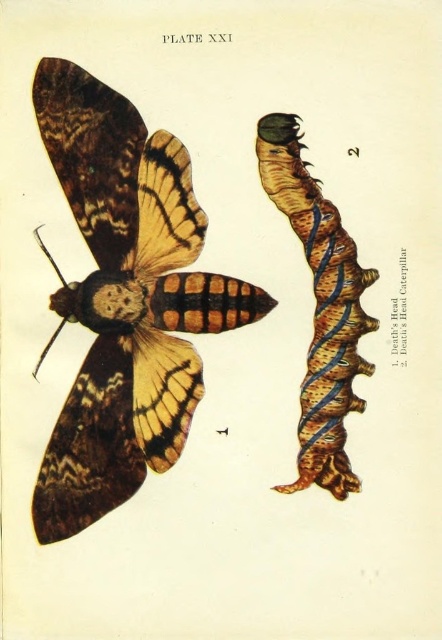
Question: Can you confirm if brown textured moth at left is thinner than brown textured caterpillar at right?

Choices:
 (A) no
 (B) yes

Answer: (A)

Question: Among these objects, which one is nearest to the camera?

Choices:
 (A) brown textured moth at left
 (B) brown textured caterpillar at right

Answer: (A)

Question: Among these objects, which one is farthest from the camera?

Choices:
 (A) brown textured caterpillar at right
 (B) brown textured moth at left

Answer: (A)

Question: Does brown textured moth at left come in front of brown textured caterpillar at right?

Choices:
 (A) yes
 (B) no

Answer: (A)

Question: Considering the relative positions of brown textured moth at left and brown textured caterpillar at right in the image provided, where is brown textured moth at left located with respect to brown textured caterpillar at right?

Choices:
 (A) right
 (B) left

Answer: (B)